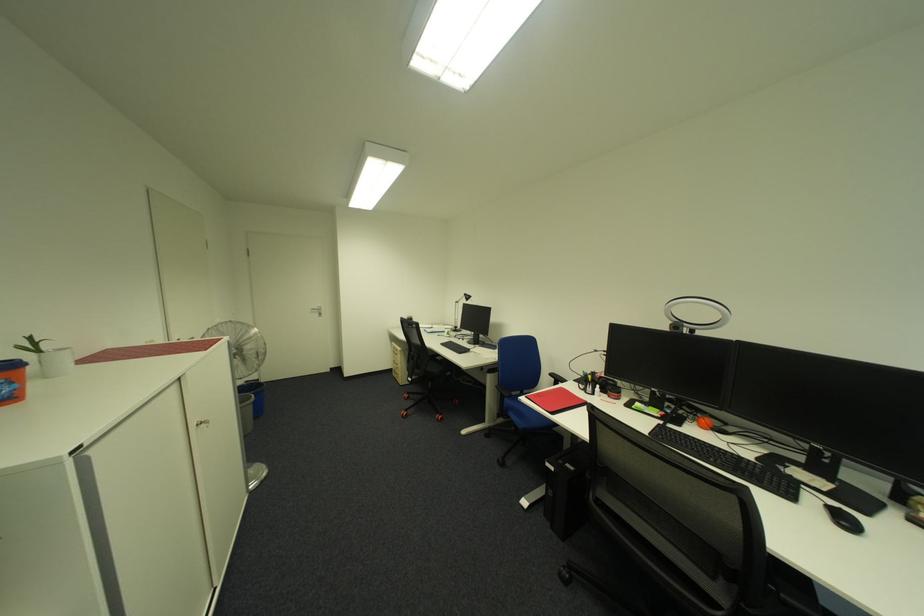
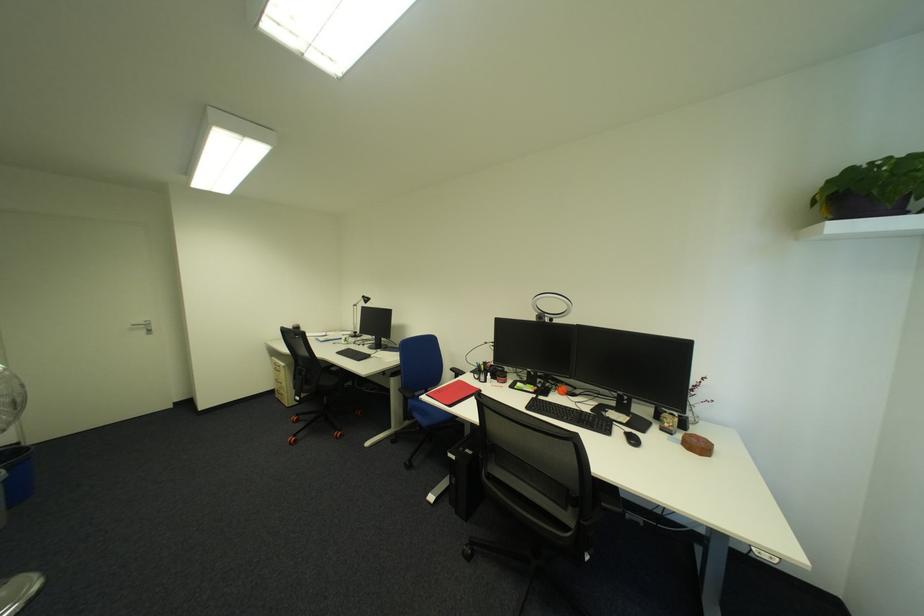
The point at (821, 501) is marked in the first image. Where is the corresponding point in the second image?

(628, 432)